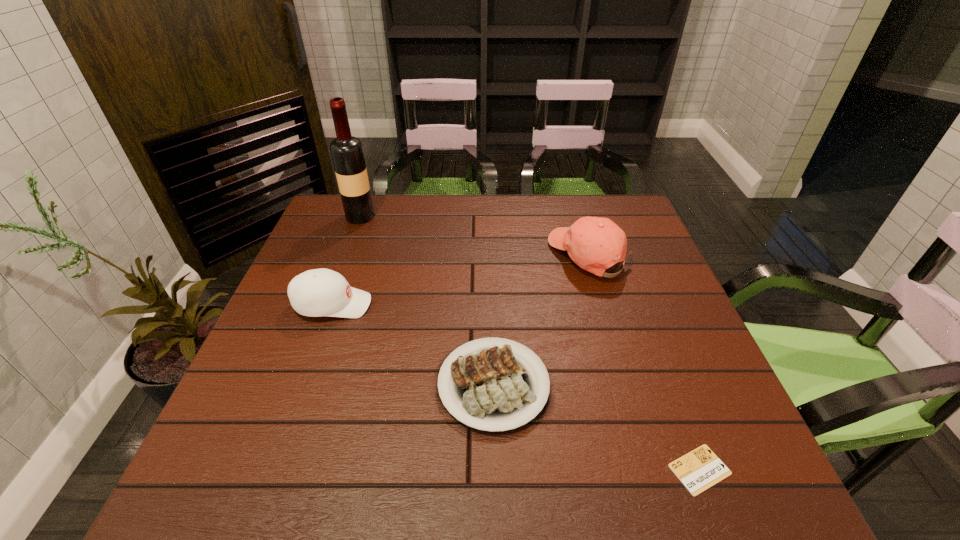
The height and width of the screenshot is (540, 960). In the image, there is a desktop. Find the location of `free space at the near right corner`. free space at the near right corner is located at coordinates (734, 467).

Where is `free spot between the nearer baseball cap and the farthest object`? The image size is (960, 540). free spot between the nearer baseball cap and the farthest object is located at coordinates (347, 261).

I want to click on free space between the second tallest object and the wine bottle, so click(x=474, y=237).

You are a GUI agent. You are given a task and a screenshot of the screen. Output one action in this format:
    pyautogui.click(x=<x>, y=<y>)
    Task: Click on the unoccupied position between the tallest object and the left baseball cap
    
    Given the screenshot: What is the action you would take?
    pyautogui.click(x=347, y=261)

Where is `free space between the nearer baseball cap and the wine bottle`? The height and width of the screenshot is (540, 960). free space between the nearer baseball cap and the wine bottle is located at coordinates (347, 261).

The height and width of the screenshot is (540, 960). What are the coordinates of `empty space that is in between the third tallest object and the farther baseball cap` in the screenshot? It's located at (460, 280).

The image size is (960, 540). Find the location of `vacant area between the third object from right to left and the farther baseball cap`. vacant area between the third object from right to left and the farther baseball cap is located at coordinates (540, 320).

Where is `vacant space that is in between the plate and the wine bottle`? vacant space that is in between the plate and the wine bottle is located at coordinates (427, 301).

This screenshot has height=540, width=960. What are the coordinates of `vacant area that lies between the farthest object and the third nearest object` in the screenshot? It's located at (347, 261).

Locate an element on the screen. empty space that is in between the nearest object and the right baseball cap is located at coordinates (644, 363).